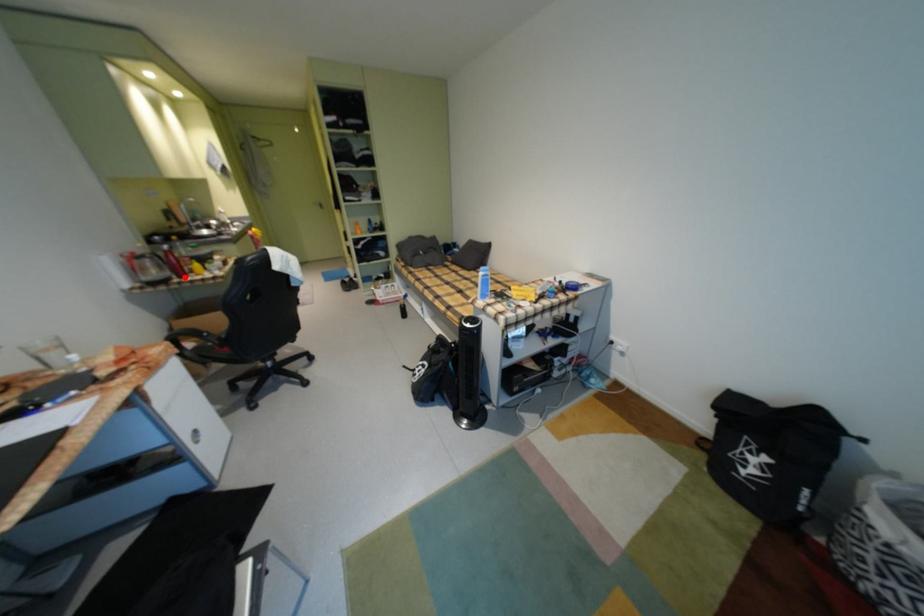
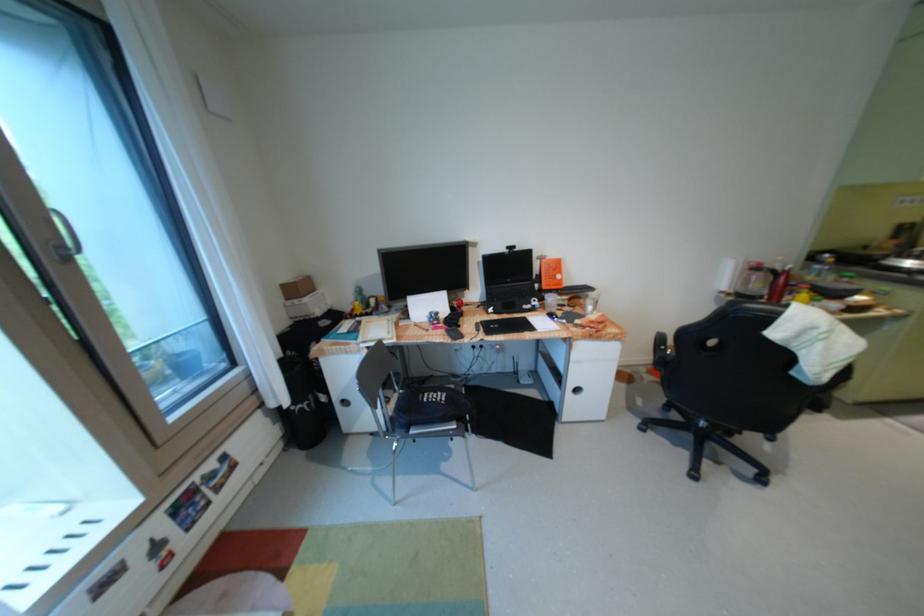
In the second image, find the point that corresponds to the highlighted location in the first image.

(776, 299)